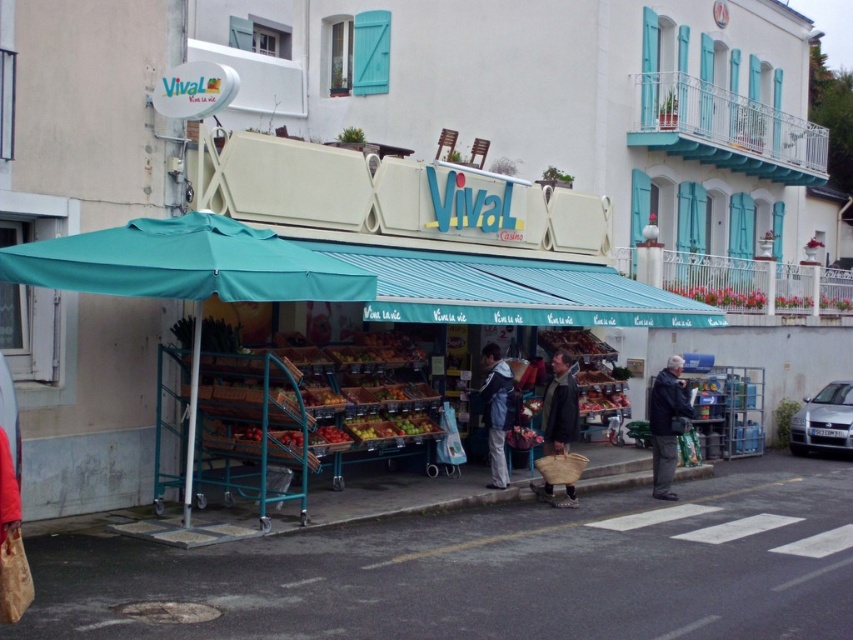
You are a customer at the market stall and want to buy both the teal fabric umbrella at center and the blue denim jacket at center. You notice that there is a limited space in your bag. Which item should you choose to carry first to ensure it fits in your bag?

The teal fabric umbrella at center is larger in size than blue denim jacket at center, so you should carry the teal fabric umbrella at center first to ensure it fits in your bag.

You are a customer at the Vival market stall and want to place your brown canvas bag at center on the counter. The counter is located at point 0.5, 0.5. Is your bag currently closer to the counter or further away?

The brown canvas bag at center is located at point (560,404), which is further away from the counter at (426,320) than if it were placed directly on it. Therefore, the bag is currently further away from the counter.